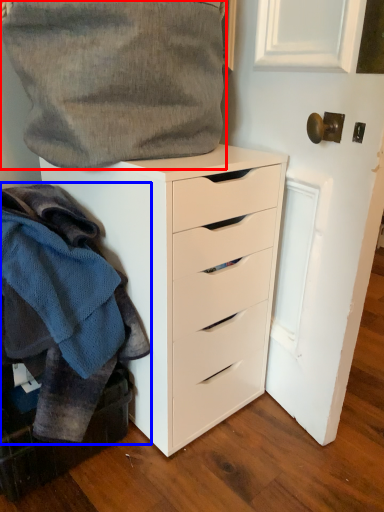
Question: Which object is further to the camera taking this photo, gray (highlighted by a red box) or clothing (highlighted by a blue box)?

Choices:
 (A) gray
 (B) clothing

Answer: (A)